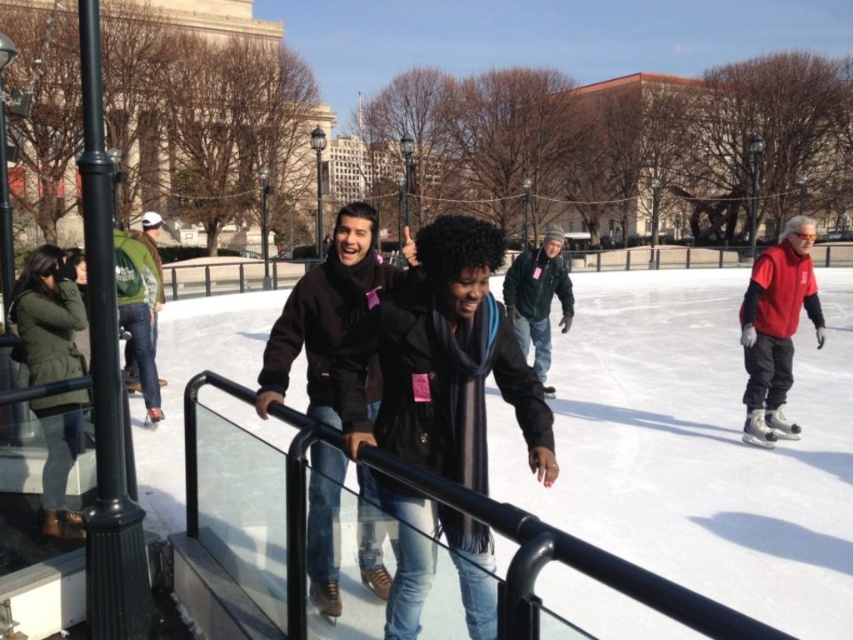
Between point (415, 500) and point (148, 232), which one is positioned in front?

Point (415, 500) is more forward.

Does point (492, 269) come in front of point (149, 237)?

That is True.

At what (x,y) coordinates should I click in order to perform the action: click on black matte jacket at center. Please return your answer as a coordinate pair (x, y). This screenshot has width=853, height=640. Looking at the image, I should click on (444, 362).

How much distance is there between green fuzzy coat at left and red fleece jacket at right?

Result: green fuzzy coat at left and red fleece jacket at right are 18.05 feet apart.

Find the location of `green fuzzy coat at left`. green fuzzy coat at left is located at coordinates (48, 316).

This screenshot has height=640, width=853. In order to click on green fuzzy coat at left in this screenshot , I will do `click(48, 316)`.

Consider the image. Can you confirm if black matte jacket at center is shorter than black glossy rail at center?

In fact, black matte jacket at center may be taller than black glossy rail at center.

Is black matte jacket at center positioned before black glossy rail at center?

No, it is behind black glossy rail at center.

What are the coordinates of `black matte jacket at center` in the screenshot? It's located at (444, 362).